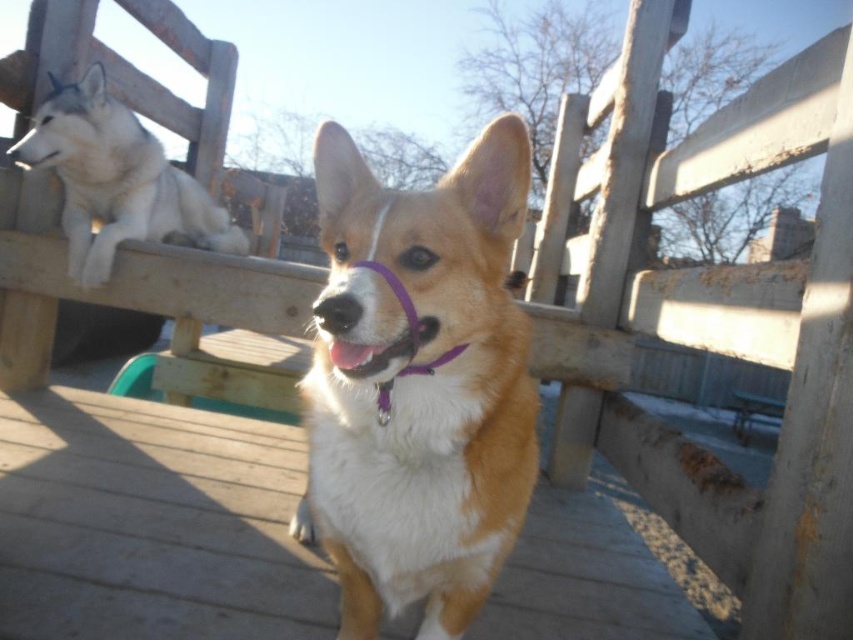
Based on the photo, between wooden deck at center and white fur dog at upper left, which one is positioned lower?

wooden deck at center

Who is taller, wooden deck at center or white fur dog at upper left?

With more height is white fur dog at upper left.

Is point (316, 557) positioned before point (123, 189)?

Yes, point (316, 557) is in front of point (123, 189).

Find the location of `wooden deck at center`. wooden deck at center is located at coordinates (151, 524).

Does wooden deck at center appear on the left side of golden fur dog at center?

Correct, you'll find wooden deck at center to the left of golden fur dog at center.

Is wooden deck at center bigger than golden fur dog at center?

Indeed, wooden deck at center has a larger size compared to golden fur dog at center.

Who is more distant from viewer, [248,636] or [340,582]?

The point [340,582] is behind.

I want to click on wooden deck at center, so click(151, 524).

Can you confirm if golden fur dog at center is positioned below white fur dog at upper left?

Yes.

Who is positioned more to the right, golden fur dog at center or white fur dog at upper left?

golden fur dog at center is more to the right.

Between point (397, 234) and point (119, 237), which one is positioned in front?

Point (397, 234) is in front.

At what (x,y) coordinates should I click in order to perform the action: click on golden fur dog at center. Please return your answer as a coordinate pair (x, y). The height and width of the screenshot is (640, 853). Looking at the image, I should click on [x=418, y=385].